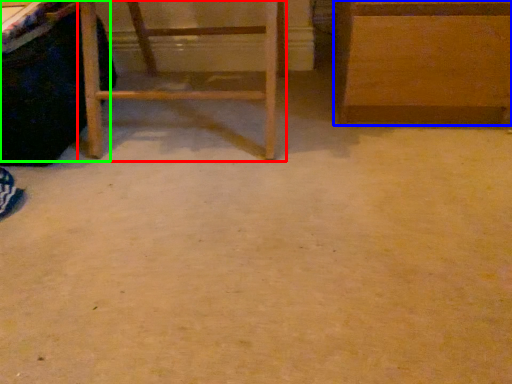
Question: Estimate the real-world distances between objects in this image. Which object is closer to furniture (highlighted by a red box), furniture (highlighted by a blue box) or vanity (highlighted by a green box)?

Choices:
 (A) furniture
 (B) vanity

Answer: (B)